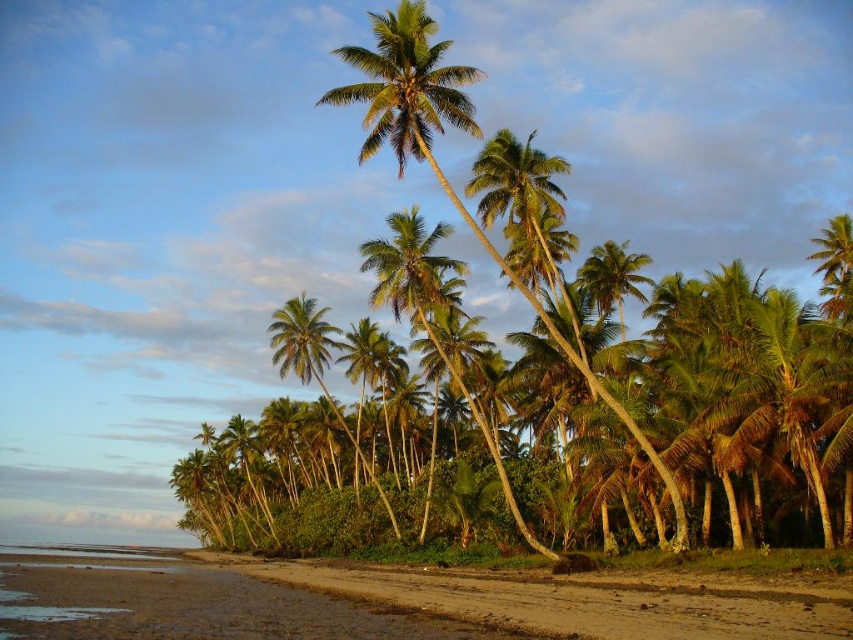
Question: Is green leafy coconut tree at center to the right of brown sandy beach at lower left from the viewer's perspective?

Choices:
 (A) no
 (B) yes

Answer: (A)

Question: Does green leafy coconut tree at center appear over brown sandy beach at lower left?

Choices:
 (A) no
 (B) yes

Answer: (B)

Question: Which object is closer to the camera taking this photo?

Choices:
 (A) brown sandy beach at lower left
 (B) green leafy coconut tree at center

Answer: (A)

Question: Which point appears closest to the camera in this image?

Choices:
 (A) (244, 564)
 (B) (399, 403)

Answer: (A)

Question: Is green leafy coconut tree at center in front of brown sandy beach at lower left?

Choices:
 (A) no
 (B) yes

Answer: (A)

Question: Which object appears closest to the camera in this image?

Choices:
 (A) green leafy coconut tree at center
 (B) brown sandy beach at lower left

Answer: (B)